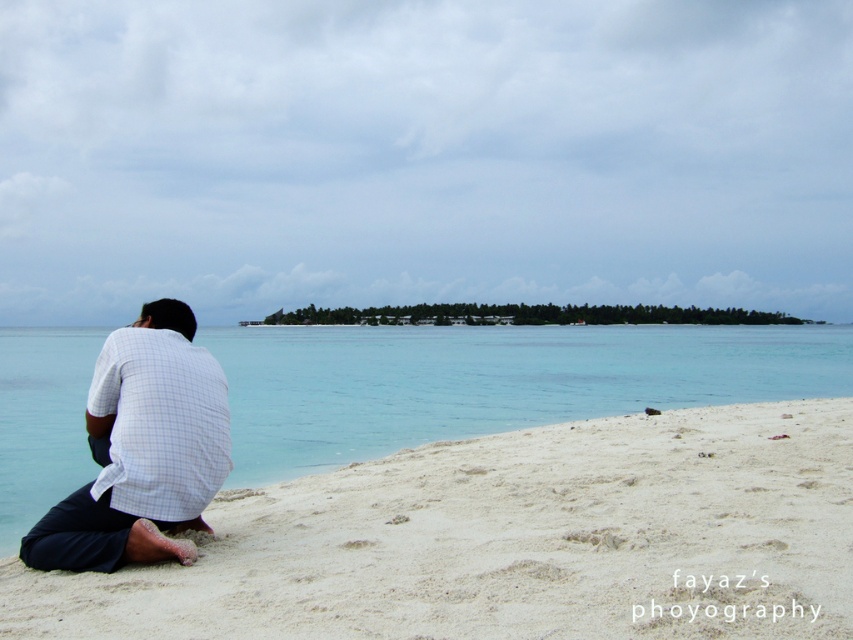
Can you confirm if white sandy beach at lower left is wider than white checkered shirt at lower left?

Yes, white sandy beach at lower left is wider than white checkered shirt at lower left.

Who is positioned more to the left, white sandy beach at lower left or white checkered shirt at lower left?

white checkered shirt at lower left is more to the left.

You are a GUI agent. You are given a task and a screenshot of the screen. Output one action in this format:
    pyautogui.click(x=<x>, y=<y>)
    Task: Click on the white sandy beach at lower left
    
    Given the screenshot: What is the action you would take?
    pyautogui.click(x=509, y=540)

This screenshot has width=853, height=640. What are the coordinates of `white sandy beach at lower left` in the screenshot? It's located at (509, 540).